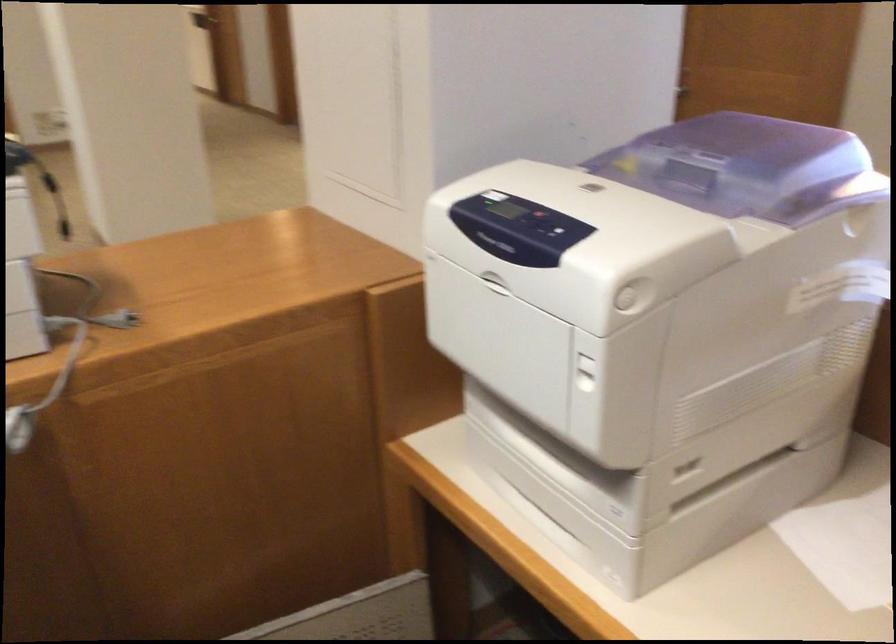
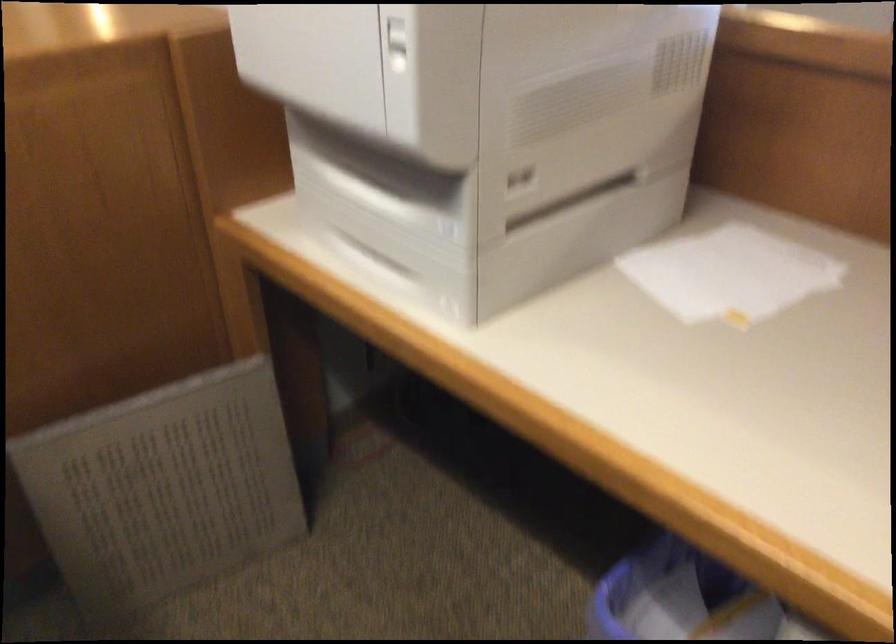
Question: The images are taken continuously from a first-person perspective. In which direction is your viewpoint rotating?

Choices:
 (A) Left
 (B) Right
 (C) Up
 (D) Down

Answer: (D)